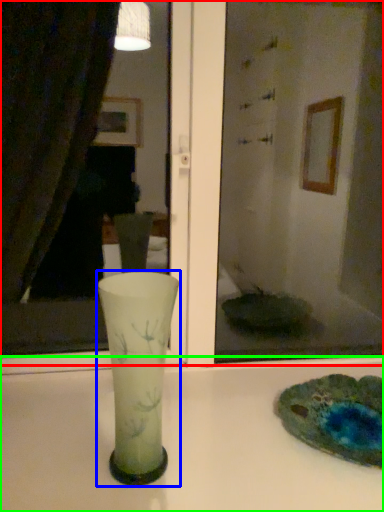
Question: Which is farther away from mirror (highlighted by a red box)? vase (highlighted by a blue box) or counter top (highlighted by a green box)?

Choices:
 (A) vase
 (B) counter top

Answer: (A)